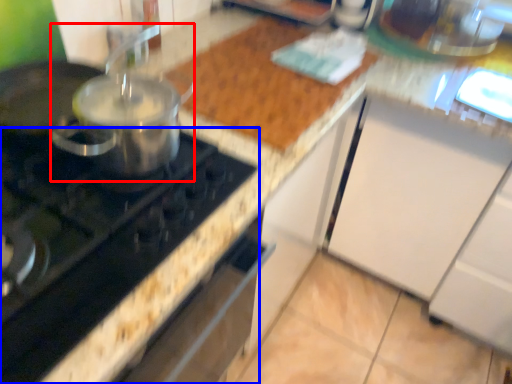
Question: Which of the following is the closest to the observer, kitchen appliance (highlighted by a red box) or gas stove (highlighted by a blue box)?

Choices:
 (A) kitchen appliance
 (B) gas stove

Answer: (B)